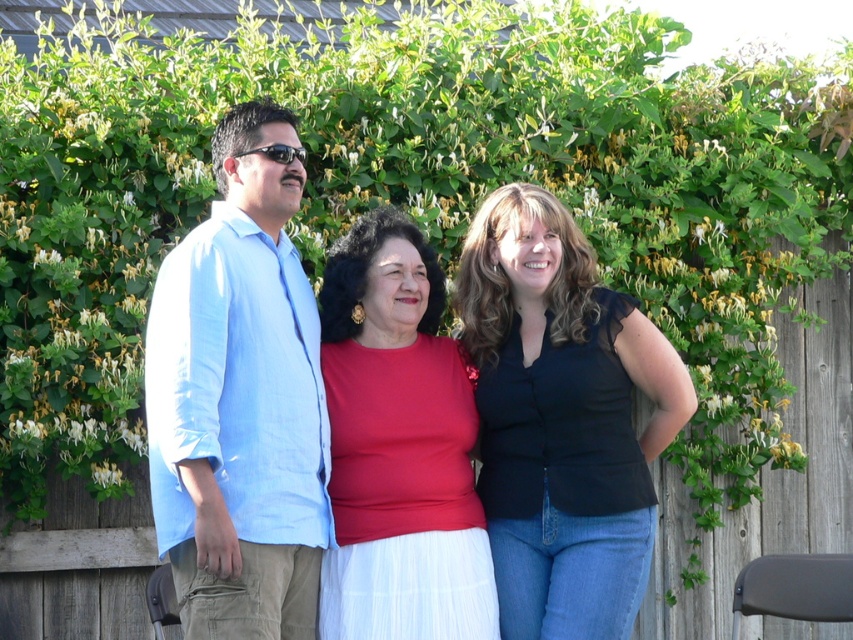
Question: Which point is closer to the camera?

Choices:
 (A) (643, 486)
 (B) (247, 618)

Answer: (B)

Question: Does light blue shirt at center lie behind matte red blouse at center?

Choices:
 (A) yes
 (B) no

Answer: (B)

Question: Is the position of light blue shirt at center less distant than that of black matte top at center?

Choices:
 (A) yes
 (B) no

Answer: (A)

Question: Which object appears farthest from the camera in this image?

Choices:
 (A) light blue shirt at center
 (B) light blue cotton shirt at left
 (C) matte red blouse at center

Answer: (C)

Question: Which object is farther from the camera taking this photo?

Choices:
 (A) light blue cotton shirt at left
 (B) black matte top at center
 (C) light blue shirt at center
 (D) matte red blouse at center

Answer: (B)

Question: Can you confirm if light blue shirt at center is positioned below light blue cotton shirt at left?

Choices:
 (A) no
 (B) yes

Answer: (A)